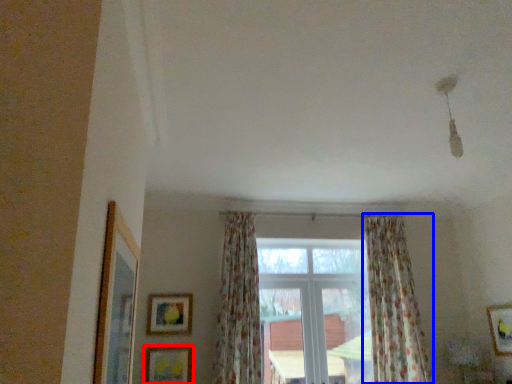
Question: Which object appears farthest to the camera in this image, picture frame (highlighted by a red box) or curtain (highlighted by a blue box)?

Choices:
 (A) picture frame
 (B) curtain

Answer: (A)